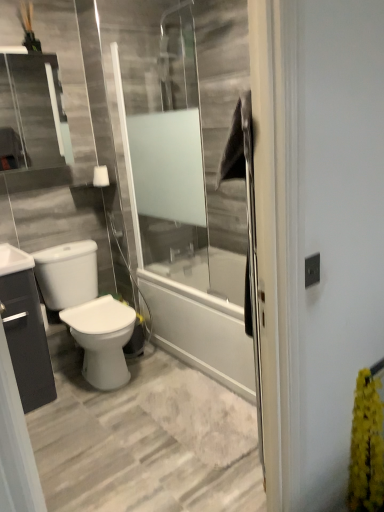
Locate an element on the screen. The width and height of the screenshot is (384, 512). free space in front of white glossy toilet at lower left is located at coordinates (91, 414).